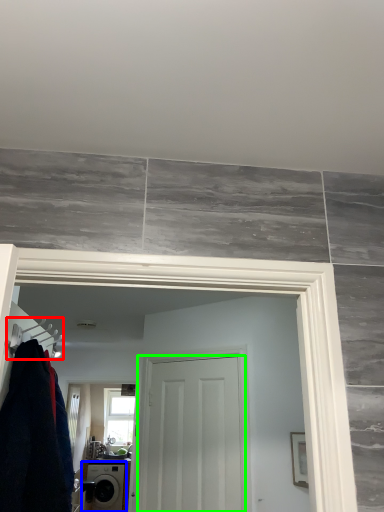
Question: Based on their relative distances, which object is nearer to hanger (highlighted by a red box)? Choose from washing machine (highlighted by a blue box) and door (highlighted by a green box).

Choices:
 (A) washing machine
 (B) door

Answer: (B)